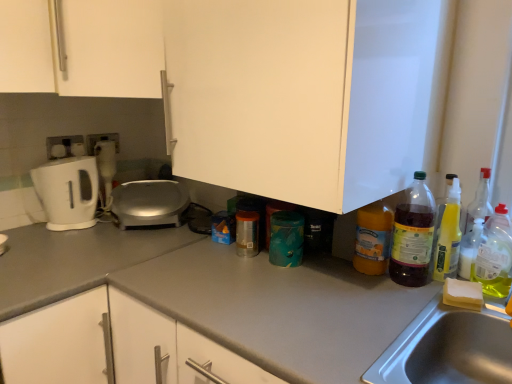
At what (x,y) coordinates should I click in order to perform the action: click on vacant space situated above gray matte countertop at center (from a real-world perspective). Please return your answer as a coordinate pair (x, y). The width and height of the screenshot is (512, 384). Looking at the image, I should click on (298, 289).